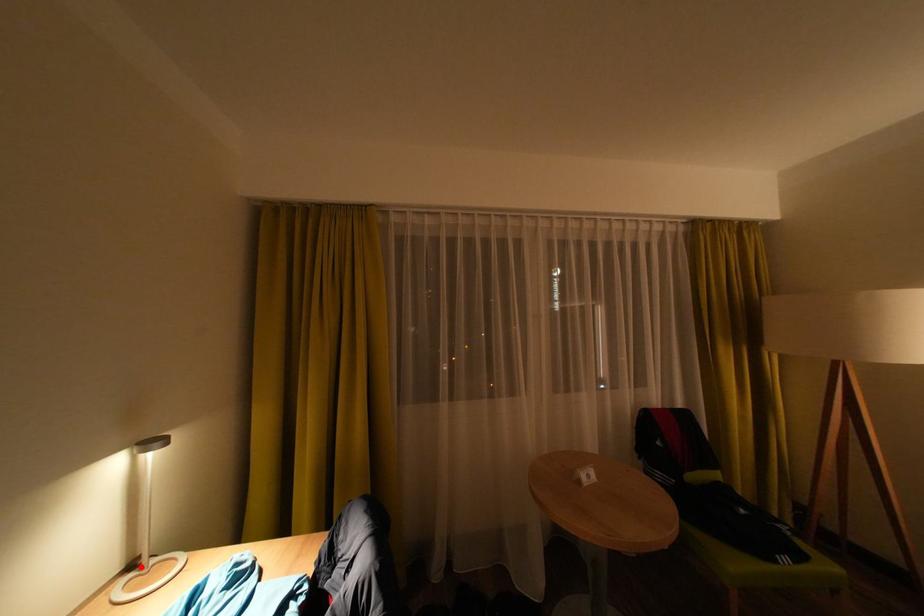
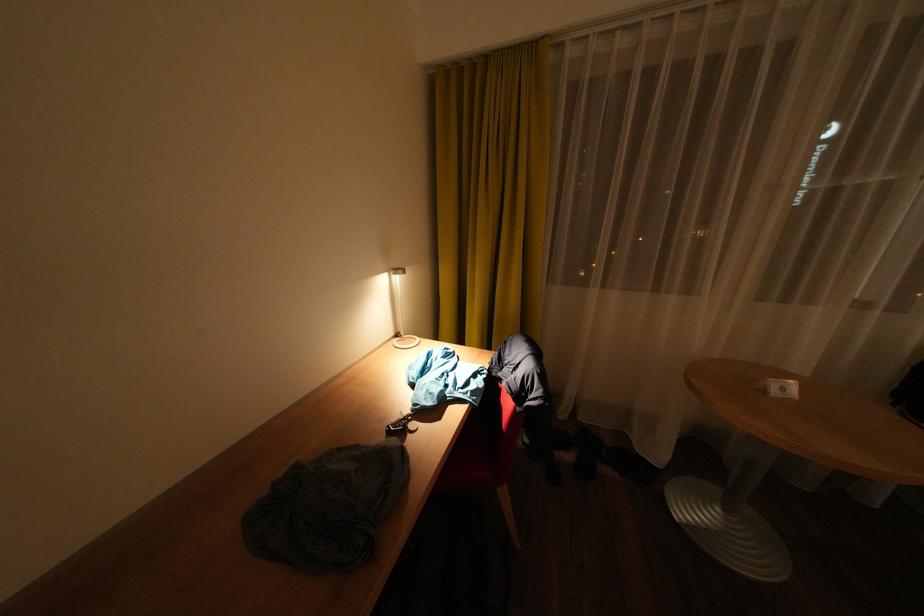
In the second image, find the point that corresponds to the highlighted location in the first image.

(407, 336)